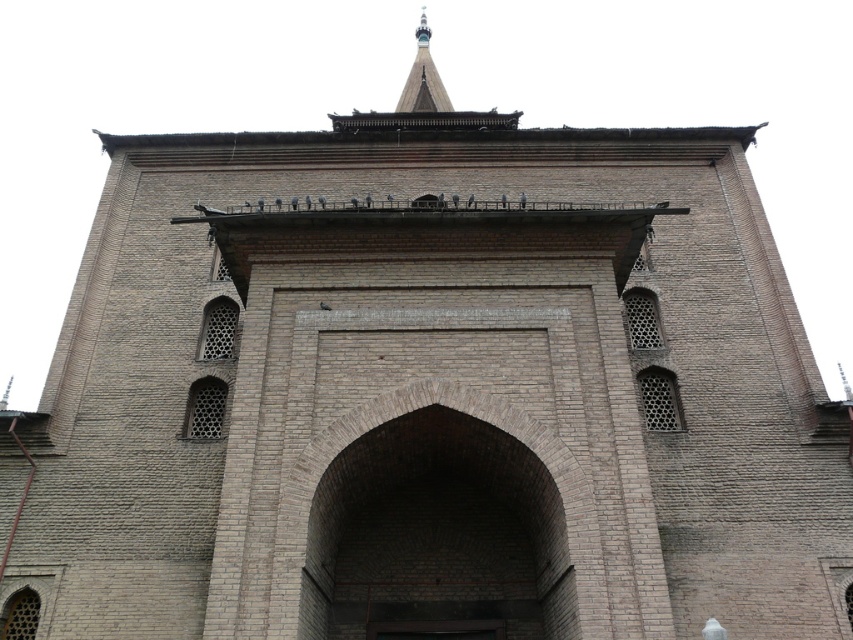
In the scene shown: You are an architect examining the brick structure. You notice the brick archway at center and the shiny silver spire at upper center. Based on their positions, which object is closer to the left edge of the structure?

The shiny silver spire at upper center is closer to the left edge of the structure because the brick archway at center is positioned on the right side of it.

You are standing in front of the traditional brick structure and want to enter the building. Which object should you approach first, the brick archway at center or the shiny silver spire at upper center?

You should approach the brick archway at center first because it is located below the shiny silver spire at upper center, making it accessible at ground level.